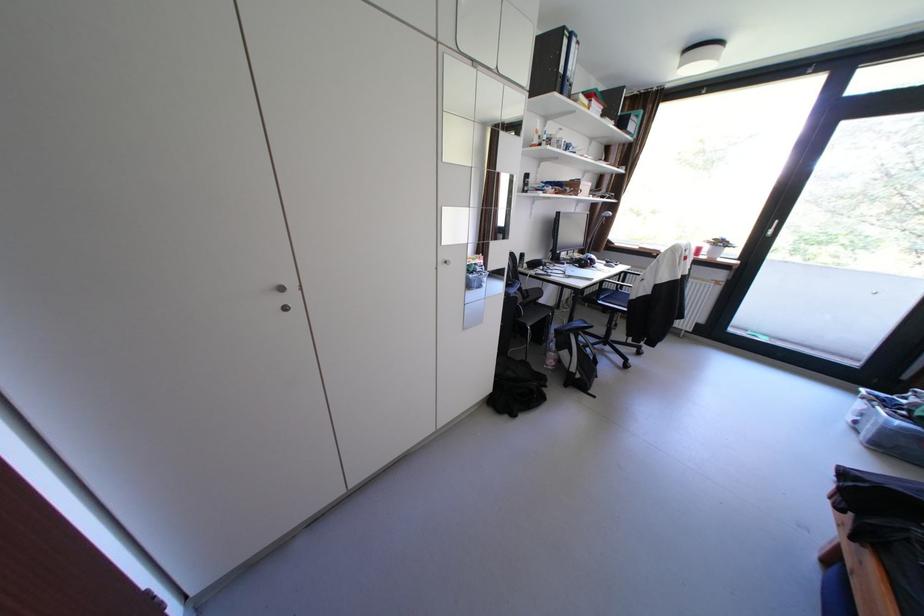
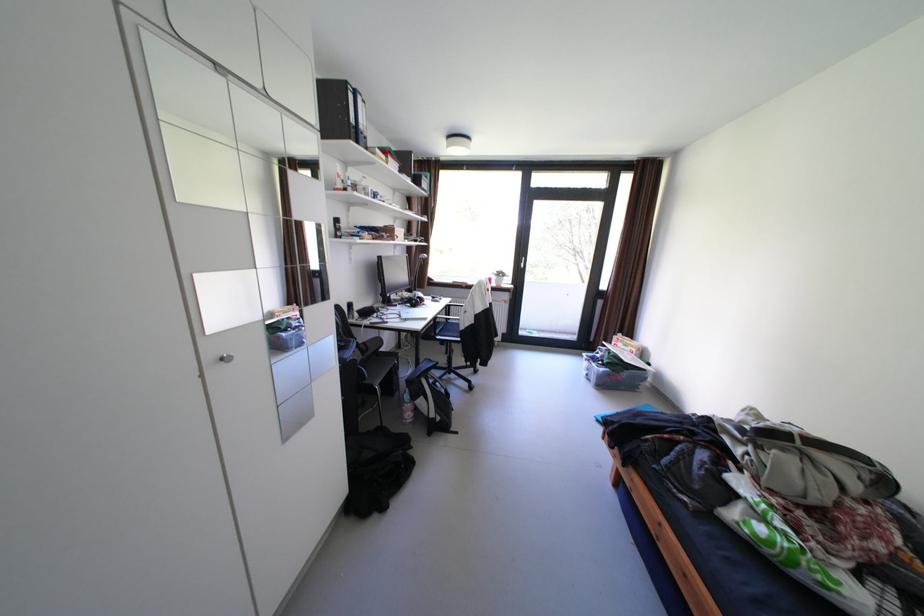
Question: How did the camera likely rotate?

Choices:
 (A) Left
 (B) Right
 (C) Up
 (D) Down

Answer: (B)